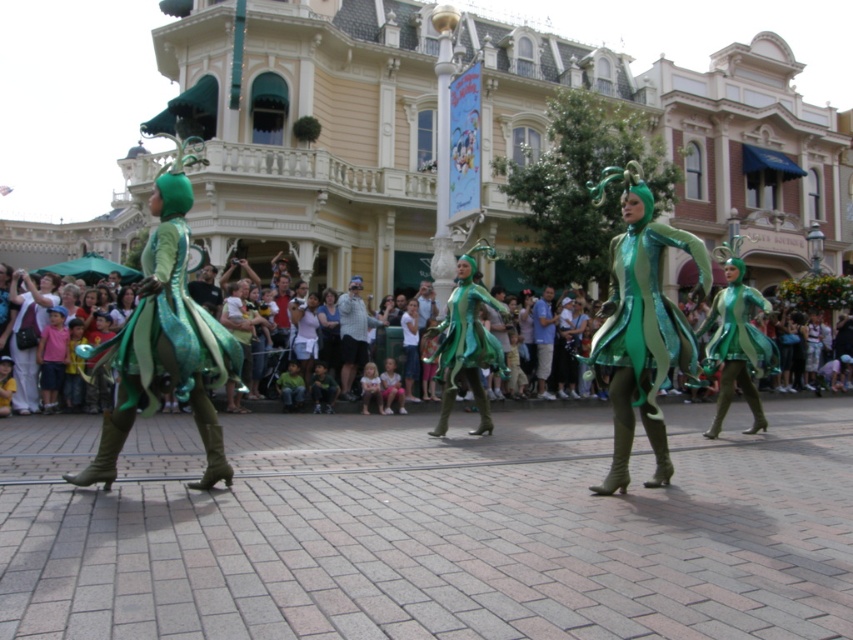
You are a photographer at the event and want to capture both the green shiny dress at left and the matte white blouse at center in a single shot. Which one is positioned closer to the front of the scene?

The green shiny dress at left is closer to the viewer than the matte white blouse at center, so it is positioned closer to the front of the scene.

You are a photographer at the event and want to capture both the performers and the crowd. You are standing at point A, which is at the lower right of the image. There are two points marked in the scene where you can move to take the photo. One is point B at coordinates point (654,252) and the other is point C at coordinates point (143,323). Which point should you choose to ensure that both the performers and the crowd are visible in your shot?

You should choose point C at coordinates point (143,323) because point B at coordinates point (654,252) is behind it, making it harder to see both the performers and the crowd clearly.

You are a photographer at the event and want to capture both the green shiny dress at left and the matte white blouse at center in a single frame. Which one should you focus on first to ensure they are both in the shot?

The green shiny dress at left is positioned on the left side of matte white blouse at center, so you should focus on the matte white blouse at center first to ensure both are included in the frame.